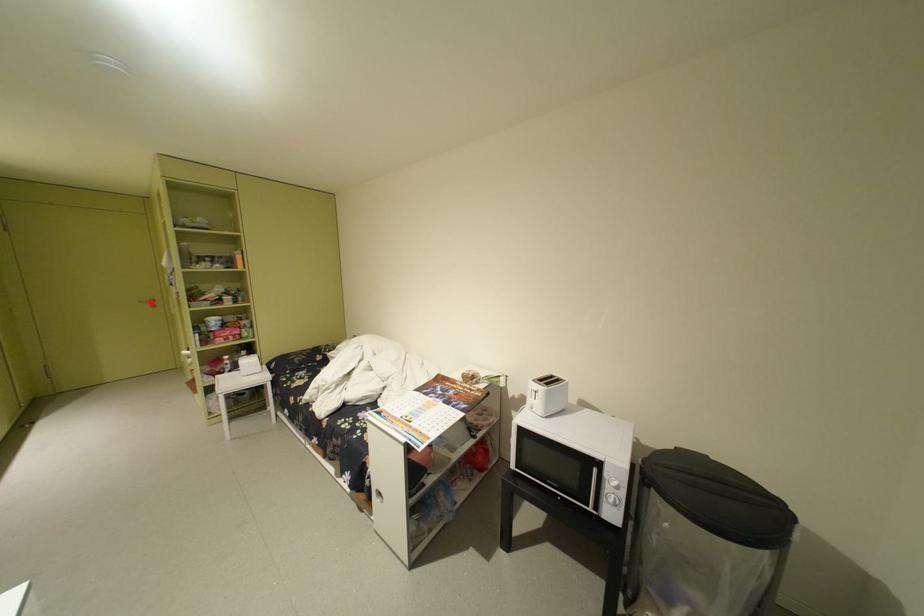
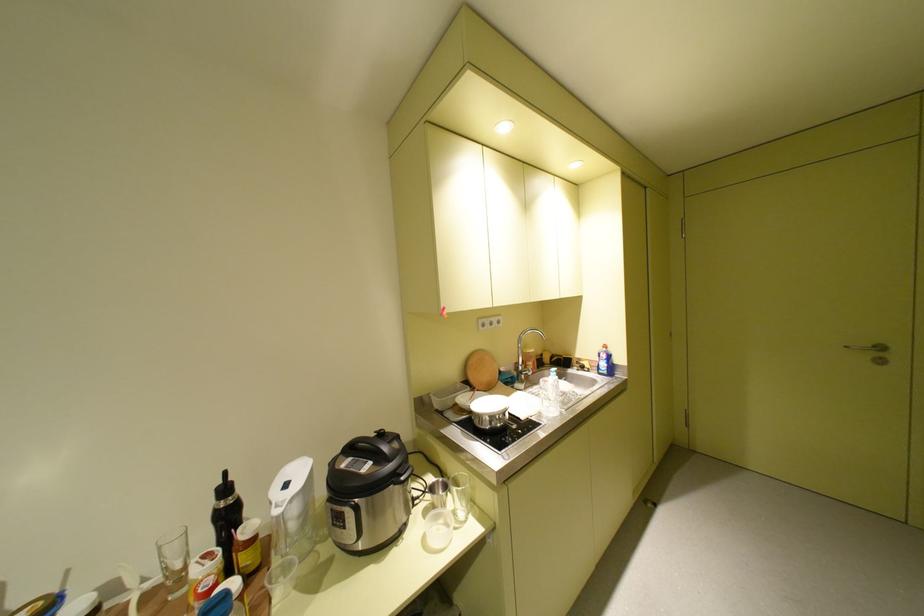
The point at the highlighted location is marked in the first image. Where is the corresponding point in the second image?

(857, 347)